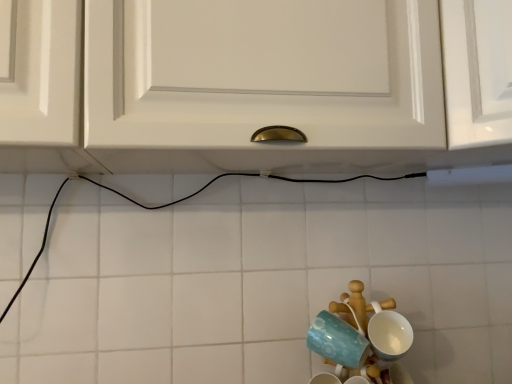
The width and height of the screenshot is (512, 384). What do you see at coordinates (252, 85) in the screenshot?
I see `white glossy cabinet at center` at bounding box center [252, 85].

Locate an element on the screen. This screenshot has height=384, width=512. white glossy cabinet at center is located at coordinates (252, 85).

Locate an element on the screen. This screenshot has height=384, width=512. white glossy cabinet at center is located at coordinates (252, 85).